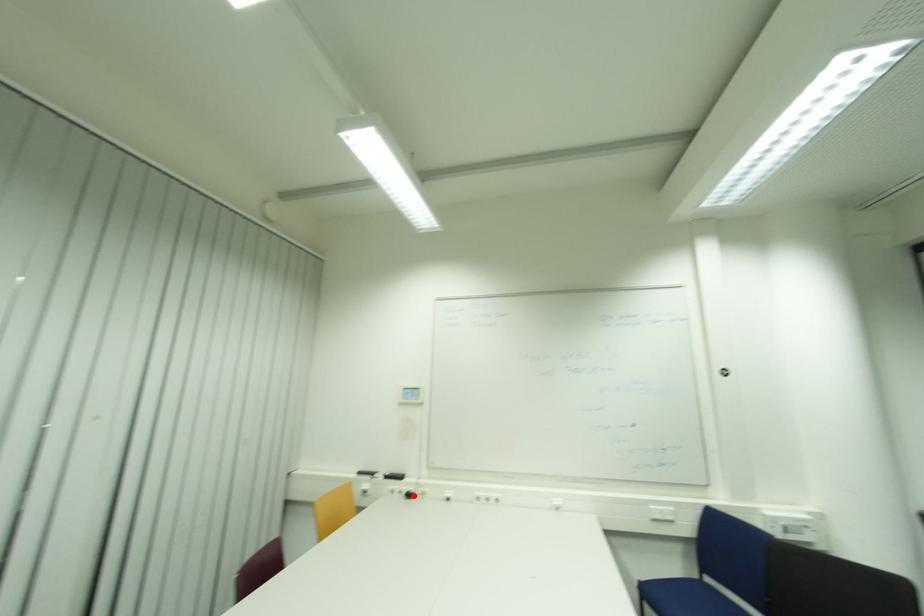
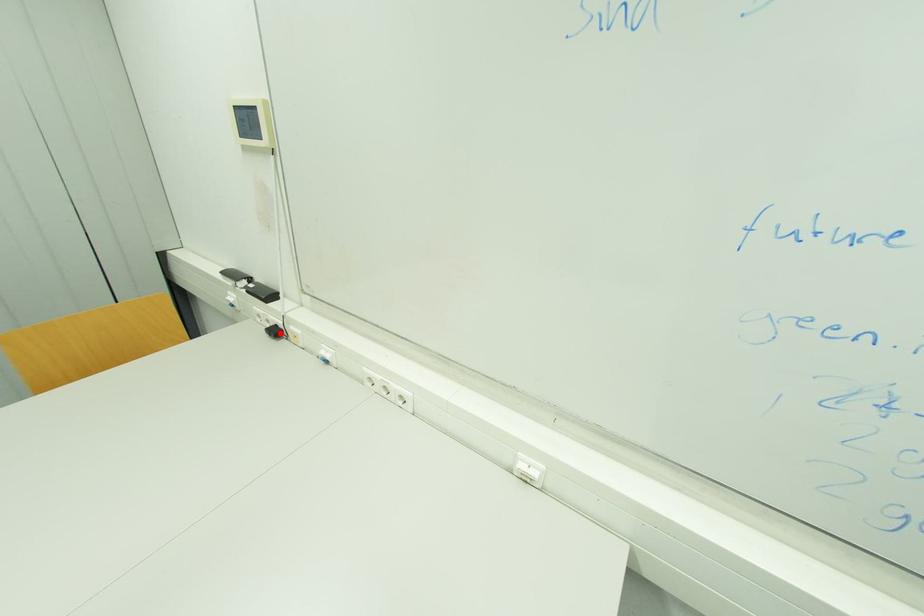
I am providing you with two images of the same scene from different viewpoints. A red point is marked on the first image and another point is marked on the second image. Do the highlighted points in image1 and image2 indicate the same real-world spot?

Yes